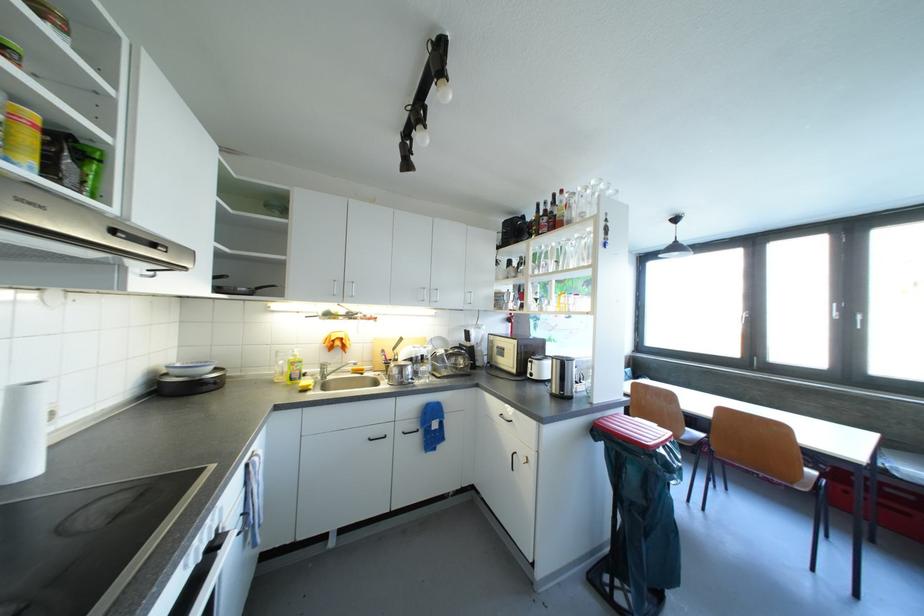
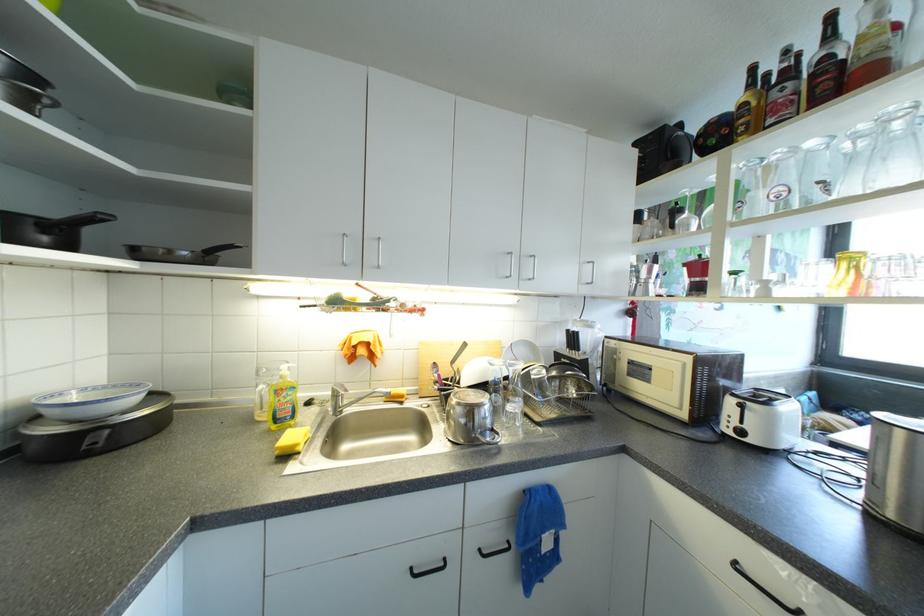
In a continuous first-person perspective shot, in which direction is the camera moving?

The cameraman moved toward left, forward.